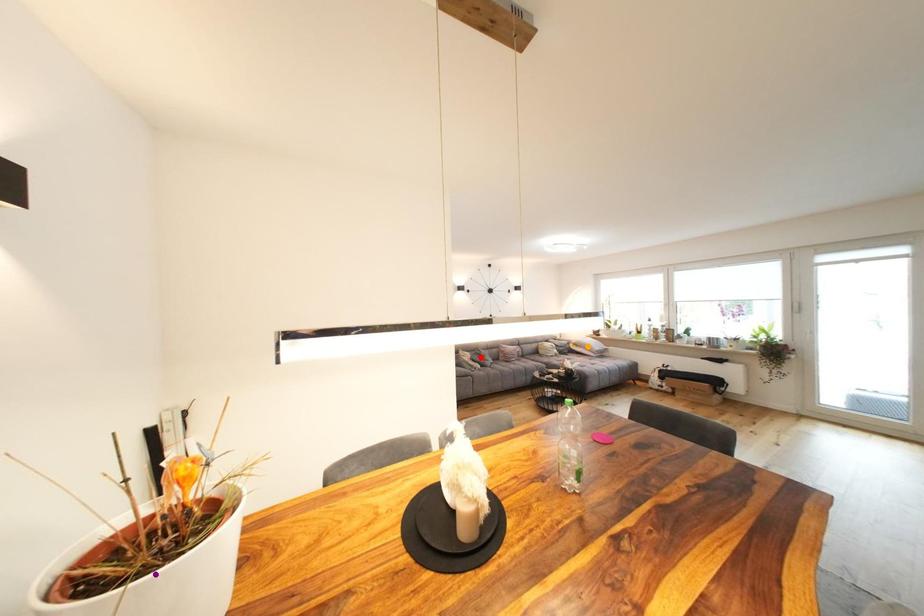
Order these from nearest to farthest:
A) orange point
B) purple point
C) red point

purple point, red point, orange point